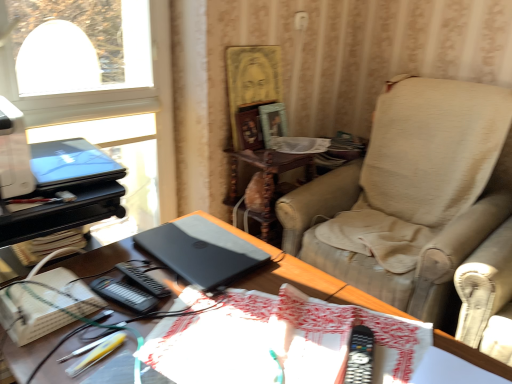
Where is `free space in front of matte wooden picture frame at upper center, which is the 2th picture frame in left-to-right order`? free space in front of matte wooden picture frame at upper center, which is the 2th picture frame in left-to-right order is located at coordinates tap(267, 154).